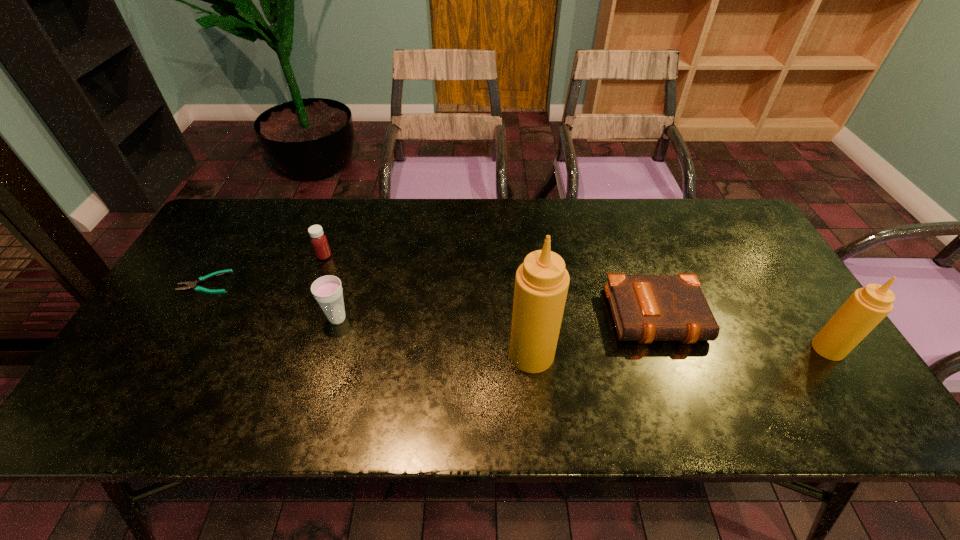
Identify the location of the taller condiment. The height and width of the screenshot is (540, 960). (541, 283).

I want to click on the left condiment, so click(x=541, y=283).

At what (x,y) coordinates should I click in order to perform the action: click on the right condiment. Please return your answer as a coordinate pair (x, y). The height and width of the screenshot is (540, 960). Looking at the image, I should click on (866, 307).

Where is `the fifth shortest object`? The width and height of the screenshot is (960, 540). the fifth shortest object is located at coordinates (866, 307).

The height and width of the screenshot is (540, 960). In order to click on the fifth object from left to right in this screenshot , I will do `click(645, 308)`.

Identify the location of the second shortest object. The image size is (960, 540). (645, 308).

You are a GUI agent. You are given a task and a screenshot of the screen. Output one action in this format:
    pyautogui.click(x=<x>, y=<y>)
    Task: Click on the fourth object from right to left
    This screenshot has height=540, width=960.
    Given the screenshot: What is the action you would take?
    pyautogui.click(x=327, y=290)

Image resolution: width=960 pixels, height=540 pixels. Identify the location of the third tallest object. (327, 290).

Where is `medicine`? The height and width of the screenshot is (540, 960). medicine is located at coordinates (319, 242).

Locate an element on the screen. The height and width of the screenshot is (540, 960). the third shortest object is located at coordinates (319, 242).